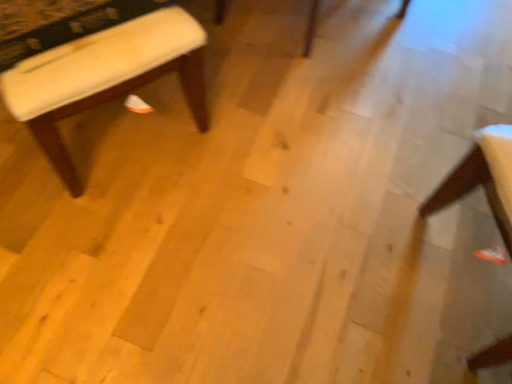
This screenshot has width=512, height=384. Find the location of `white fabric chair at lower right`. white fabric chair at lower right is located at coordinates (482, 179).

The height and width of the screenshot is (384, 512). Describe the element at coordinates (482, 179) in the screenshot. I see `white fabric chair at lower right` at that location.

Describe the element at coordinates (92, 62) in the screenshot. This screenshot has height=384, width=512. I see `white fabric stool at left` at that location.

Locate an element on the screen. Image resolution: width=512 pixels, height=384 pixels. white fabric stool at left is located at coordinates (92, 62).

Identify the location of white fabric chair at lower right. (482, 179).

Is white fabric stool at left to the left or to the right of white fabric chair at lower right in the image?

Based on their positions, white fabric stool at left is located to the left of white fabric chair at lower right.

Does white fabric stool at left come in front of white fabric chair at lower right?

No, white fabric stool at left is behind white fabric chair at lower right.

Which point is more forward, (195, 47) or (487, 166)?

The point (487, 166) is closer.

From the image's perspective, does white fabric stool at left appear lower than white fabric chair at lower right?

Actually, white fabric stool at left appears above white fabric chair at lower right in the image.

From a real-world perspective, is white fabric stool at left positioned above or below white fabric chair at lower right?

white fabric stool at left is situated higher than white fabric chair at lower right in the real world.

Can you confirm if white fabric stool at left is thinner than white fabric chair at lower right?

No.

Which of these two, white fabric stool at left or white fabric chair at lower right, stands shorter?

Standing shorter between the two is white fabric chair at lower right.

Which of these two, white fabric stool at left or white fabric chair at lower right, is smaller?

white fabric chair at lower right is smaller.

Is white fabric stool at left completely or partially outside of white fabric chair at lower right?

Yes.

Are white fabric stool at left and white fabric chair at lower right located far from each other?

Indeed, white fabric stool at left is not near white fabric chair at lower right.

Is white fabric stool at left aimed at white fabric chair at lower right?

No, white fabric stool at left is not oriented towards white fabric chair at lower right.

How many degrees apart are the facing directions of white fabric stool at left and white fabric chair at lower right?

The facing directions of white fabric stool at left and white fabric chair at lower right are 123 degrees apart.

Locate an element on the screen. Image resolution: width=512 pixels, height=384 pixels. stool above the white fabric chair at lower right (from a real-world perspective) is located at coordinates (92, 62).

Which is more to the right, white fabric chair at lower right or white fabric stool at left?

white fabric chair at lower right.

Looking at this image, is white fabric chair at lower right in front of white fabric stool at left?

Yes, white fabric chair at lower right is closer to the camera.

Does point (487, 129) appear closer or farther from the camera than point (5, 80)?

Point (487, 129).

In the scene shown: From the image's perspective, is white fabric chair at lower right under white fabric stool at left?

Yes, from the image's perspective, white fabric chair at lower right is below white fabric stool at left.

From a real-world perspective, which object rests below the other?

white fabric chair at lower right is physically lower.

Considering the sizes of white fabric chair at lower right and white fabric stool at left in the image, is white fabric chair at lower right wider or thinner than white fabric stool at left?

Considering their sizes, white fabric chair at lower right looks slimmer than white fabric stool at left.

Who is shorter, white fabric chair at lower right or white fabric stool at left?

With less height is white fabric chair at lower right.

Based on their sizes in the image, would you say white fabric chair at lower right is bigger or smaller than white fabric stool at left?

Clearly, white fabric chair at lower right is smaller in size than white fabric stool at left.

Is white fabric chair at lower right positioned beyond the bounds of white fabric stool at left?

Yes.

Are white fabric chair at lower right and white fabric stool at left making contact?

white fabric chair at lower right is not next to white fabric stool at left, and they're not touching.

Is white fabric chair at lower right facing away from white fabric stool at left?

That's not correct — white fabric chair at lower right is not looking away from white fabric stool at left.

In order to click on stool that is above the white fabric chair at lower right (from the image's perspective) in this screenshot , I will do `click(92, 62)`.

At what (x,y) coordinates should I click in order to perform the action: click on stool above the white fabric chair at lower right (from a real-world perspective). Please return your answer as a coordinate pair (x, y). The height and width of the screenshot is (384, 512). Looking at the image, I should click on (92, 62).

Locate an element on the screen. Image resolution: width=512 pixels, height=384 pixels. chair below the white fabric stool at left (from a real-world perspective) is located at coordinates (482, 179).